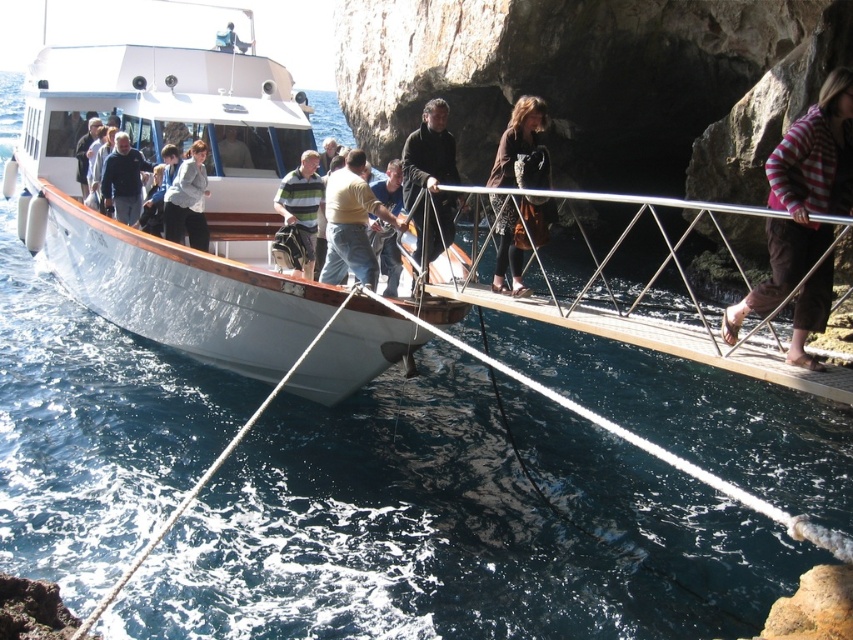
You are a photographer standing on the rocky shore. You want to take a photo of the white polished wood boat at center and the striped sweater at right. Which object should you focus on first if you want to capture both in the frame without moving your camera?

The white polished wood boat at center is larger in size than the striped sweater at right, so you should focus on the boat first to ensure it fits properly in the frame before adjusting for the smaller sweater.

You are a photographer standing on the rocky shore, and you want to capture a photo of the white polished wood boat at center and the striped cotton shirt at center. Which object should you focus on first if you want to ensure both are in sharp focus?

The white polished wood boat at center is positioned over striped cotton shirt at center, so you should focus on the boat first as it is closer to the camera, ensuring both objects will be in focus.

You are a photographer standing on the rocky shore near the white polished wood boat at center and the striped cotton shirt at center. You want to capture a wide shot of the boat and the shirt in the same frame. Which object should you focus on first to ensure both are in the frame?

The white polished wood boat at center is wider than the striped cotton shirt at center, so you should focus on the boat first to ensure both are in the frame.